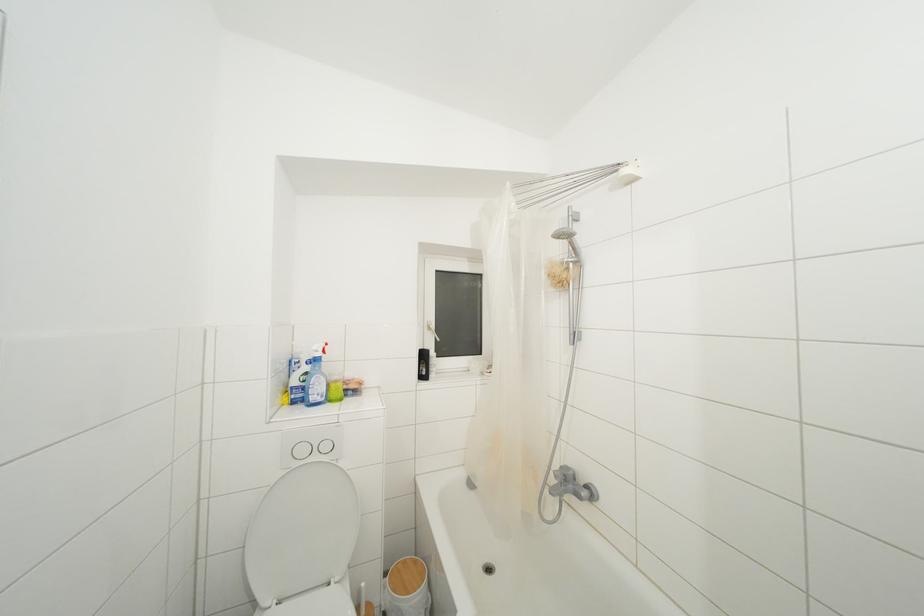
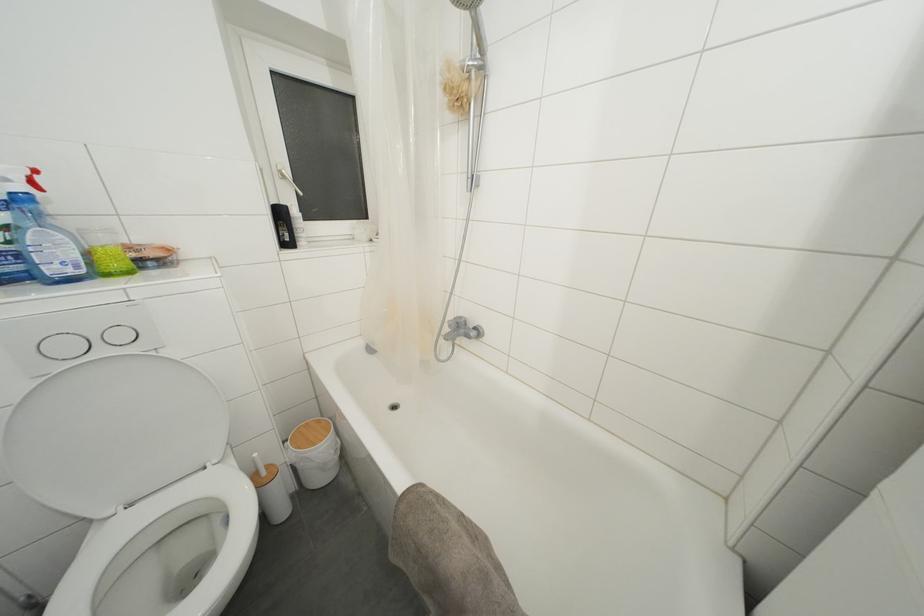
From the picture: Based on the continuous images, in which direction is the camera rotating?

The camera rotated toward right-down.